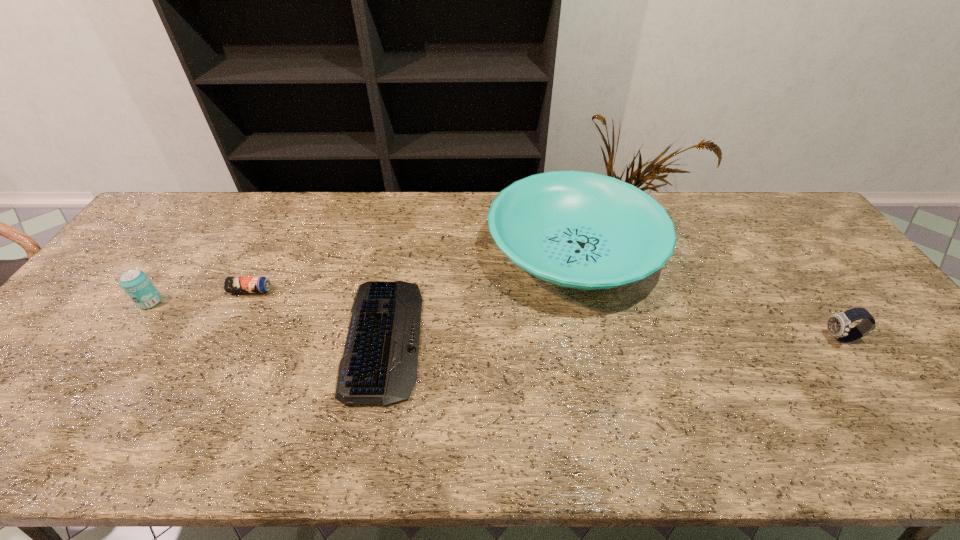
This screenshot has height=540, width=960. I want to click on free spot between the tallest object and the third object from right to left, so click(479, 295).

Locate an element on the screen. Image resolution: width=960 pixels, height=540 pixels. vacant area that lies between the rightmost object and the second shortest object is located at coordinates (545, 314).

Where is `vacant point located between the shortest object and the left beer can`? The image size is (960, 540). vacant point located between the shortest object and the left beer can is located at coordinates (267, 320).

Locate which object ranks in proximity to the right beer can. Please provide its 2D coordinates. Your answer should be formatted as a tuple, i.e. [(x, y)], where the tuple contains the x and y coordinates of a point satisfying the conditions above.

[(136, 284)]

I want to click on the second closest object to the computer keyboard, so click(x=231, y=284).